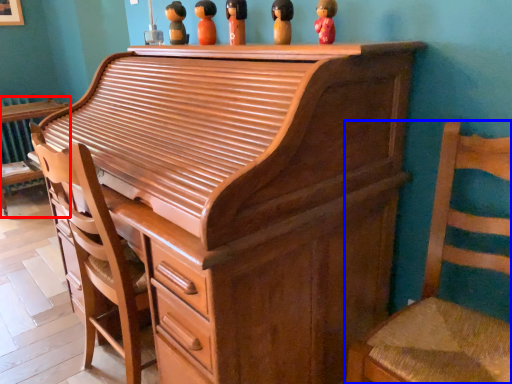
Question: Which point is closer to the camera, furniture (highlighted by a red box) or chair (highlighted by a blue box)?

Choices:
 (A) furniture
 (B) chair

Answer: (B)